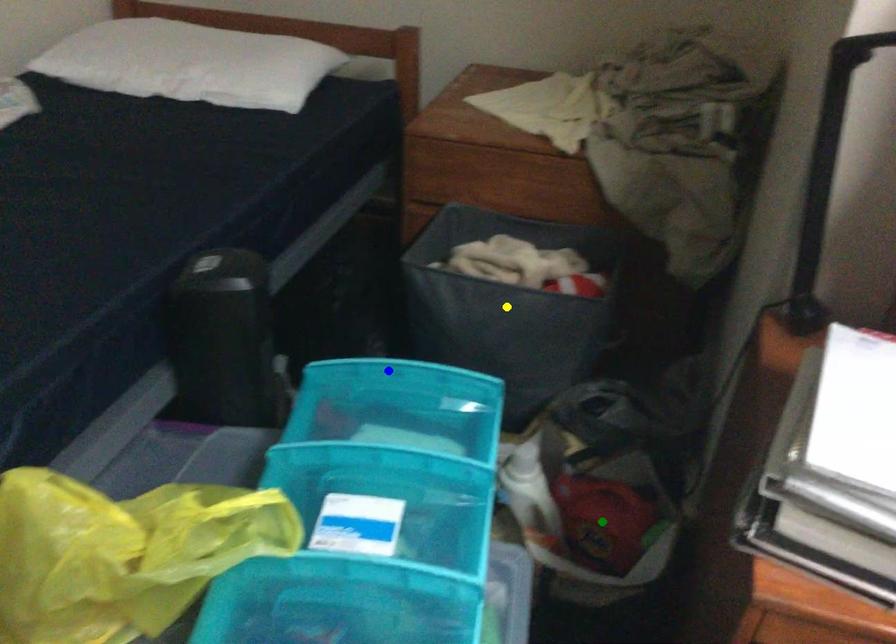
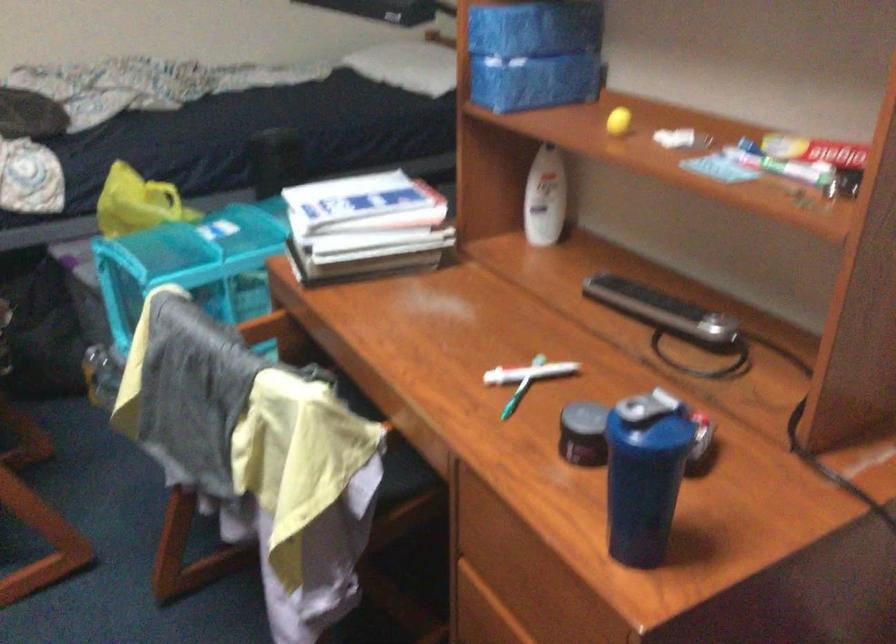
I am providing you with two images of the same scene from different viewpoints. Three points are marked in image1. Which point corresponds to a part or object that is occluded in image2?In image1, three points are marked. Which of them correspond to a part or object that is occluded in image2?Among the three points shown in image1, which one corresponds to a part or object that is no longer visible due to occlusion in image2?

Invisible in image2: yellow point, green point, blue point.